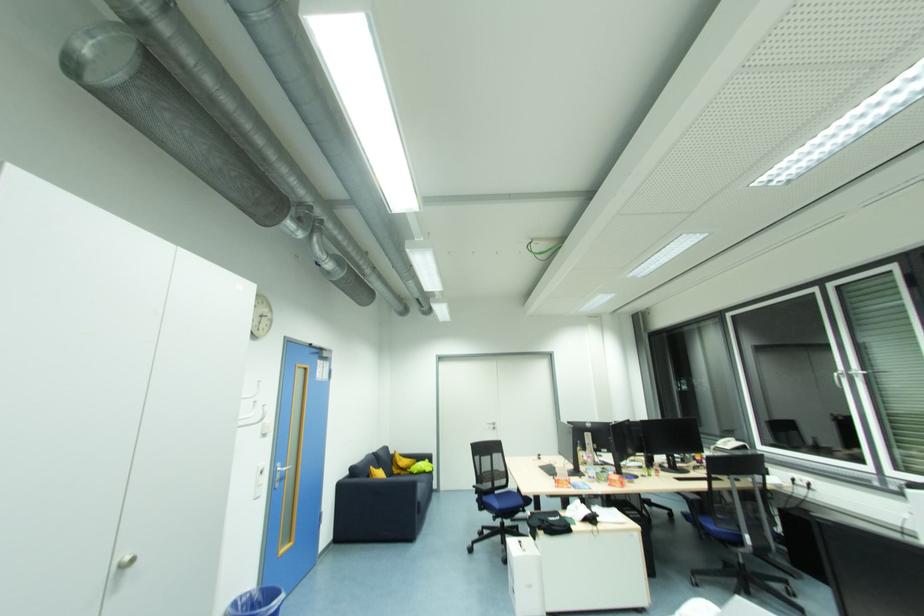
Where is `white phone receiver`? The height and width of the screenshot is (616, 924). white phone receiver is located at coordinates (728, 446).